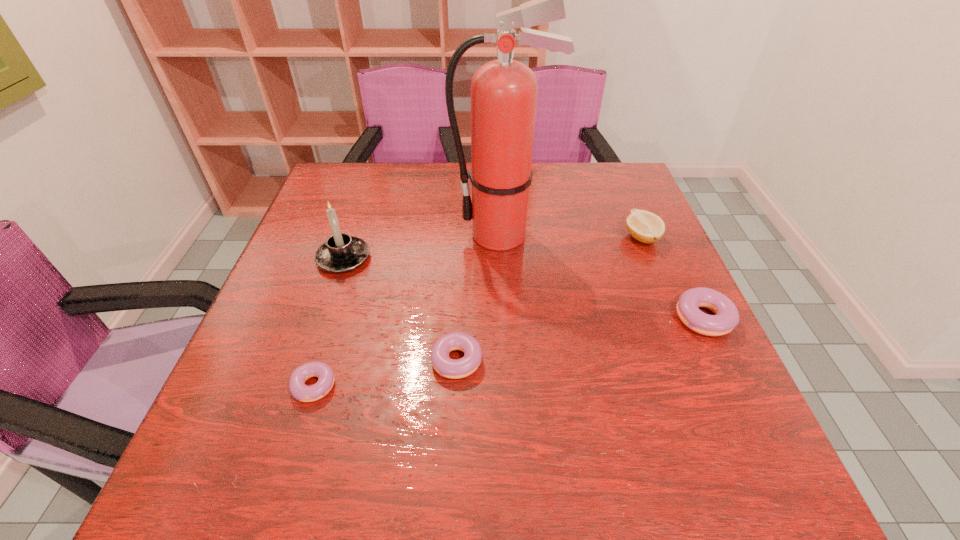
Find the location of a particular element. The image size is (960, 540). doughnut at the right edge is located at coordinates (726, 317).

Where is `lemon that is at the right edge`? The width and height of the screenshot is (960, 540). lemon that is at the right edge is located at coordinates (644, 226).

What are the coordinates of `object located in the near left corner section of the desktop` in the screenshot? It's located at (300, 391).

Identify the location of vacant space at the far edge of the desktop. (433, 173).

Identify the location of vacant space at the left edge of the desktop. The width and height of the screenshot is (960, 540). (311, 272).

Where is `free location at the right edge`? free location at the right edge is located at coordinates (632, 320).

Find the location of `free spot at the far left corner of the desktop`. free spot at the far left corner of the desktop is located at coordinates (356, 188).

This screenshot has width=960, height=540. In order to click on vacant space at the near left corner of the desktop in this screenshot , I will do `click(257, 398)`.

This screenshot has height=540, width=960. I want to click on blank area at the far right corner, so click(601, 164).

Where is `free space between the second tallest object and the shortest object`? free space between the second tallest object and the shortest object is located at coordinates (329, 322).